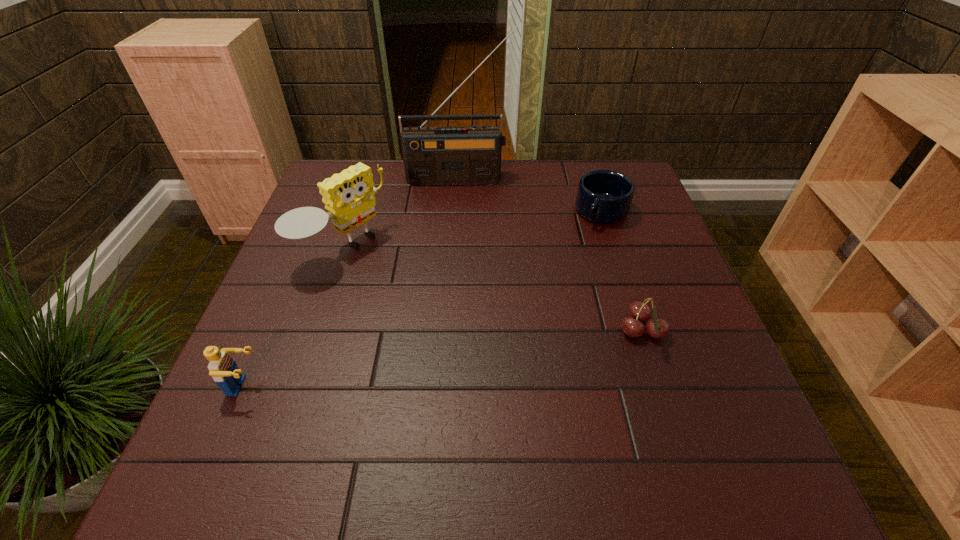
Locate an element on the screen. object at the near edge is located at coordinates [x=223, y=369].

In order to click on Lego that is at the left edge in this screenshot , I will do `click(223, 369)`.

Image resolution: width=960 pixels, height=540 pixels. Identify the location of sponge that is at the left edge. (348, 196).

Image resolution: width=960 pixels, height=540 pixels. Identify the location of cherry that is at the right edge. (638, 311).

I want to click on mug positioned at the right edge, so click(603, 196).

The width and height of the screenshot is (960, 540). I want to click on object present at the near left corner, so click(x=223, y=369).

You are a GUI agent. You are given a task and a screenshot of the screen. Output one action in this format:
    pyautogui.click(x=<x>, y=<y>)
    Task: Click on the object located at the far right corner
    The height and width of the screenshot is (540, 960).
    Given the screenshot: What is the action you would take?
    pyautogui.click(x=603, y=196)

The width and height of the screenshot is (960, 540). In the image, there is a desktop. What are the coordinates of `free space at the far edge` in the screenshot? It's located at (566, 186).

Find the location of a particular element. free space at the near edge of the desktop is located at coordinates (620, 414).

In the image, there is a desktop. Where is `free space at the left edge`? free space at the left edge is located at coordinates (310, 294).